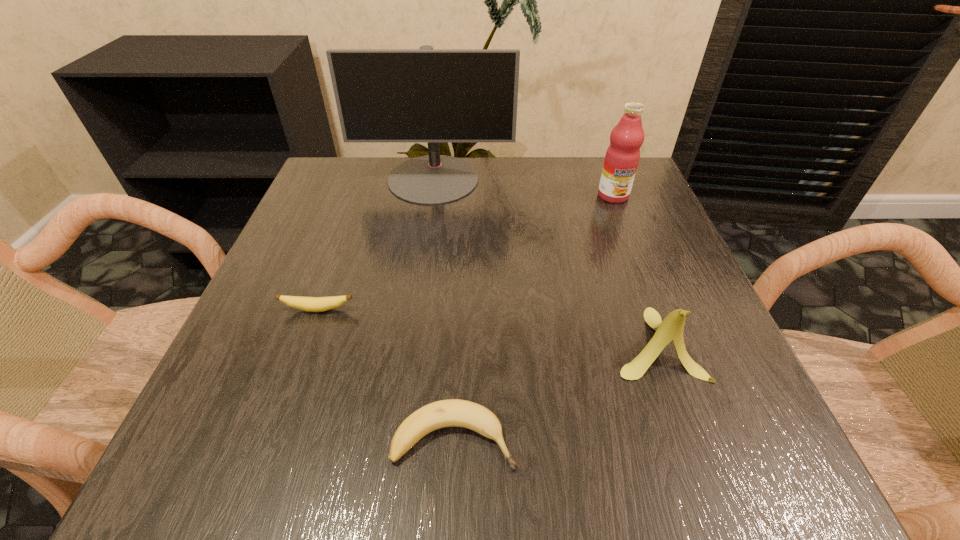
Locate an element on the screen. This screenshot has width=960, height=540. computer monitor is located at coordinates (429, 95).

Locate an element on the screen. The image size is (960, 540). the fourth shortest object is located at coordinates (622, 156).

Find the location of a particular element. the tallest banana is located at coordinates (671, 328).

This screenshot has height=540, width=960. In order to click on the rightmost banana in this screenshot , I will do `click(671, 328)`.

Where is `the leftmost banana`? The image size is (960, 540). the leftmost banana is located at coordinates (311, 304).

Where is `the nearest banana`? the nearest banana is located at coordinates (453, 412).

Where is `the second banana from left to right`? The height and width of the screenshot is (540, 960). the second banana from left to right is located at coordinates (453, 412).

The width and height of the screenshot is (960, 540). Find the location of `free space located on the screen of the tallest object`. free space located on the screen of the tallest object is located at coordinates (427, 224).

What are the coordinates of `blank area located on the label of the fruit juice` in the screenshot? It's located at (665, 331).

The image size is (960, 540). I want to click on vacant space located on the back of the third tallest object, so click(x=616, y=235).